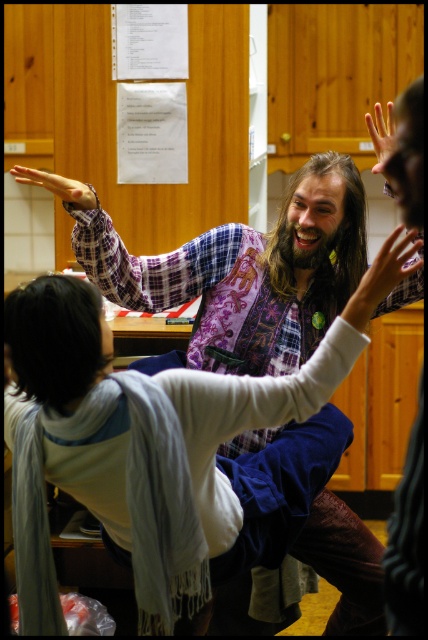
You are an observer in the scene. You notice the long brown hair at center and the smooth skin hand at upper center. Which object takes up more area in the image?

The smooth skin hand at upper center occupies more space than the long brown hair at center.

You are standing at the position of the person in the flannel shirt at center. You want to hand them a small object to the other person. Can you reach them without moving your feet?

The distance between the flannel shirt at center and the other person is 2.08 meters. Since the average human arm span is about 1.5 meters, you cannot reach them without moving closer.

You are a photographer trying to capture a candid shot of the flannel shirt at center and the smooth skin hand at upper left. Which object should you focus on first to ensure both are in sharp focus?

You should focus on the flannel shirt at center first because it is closer to the viewer than the smooth skin hand at upper left. By focusing on the closer object, the depth of field may also keep the hand in focus.